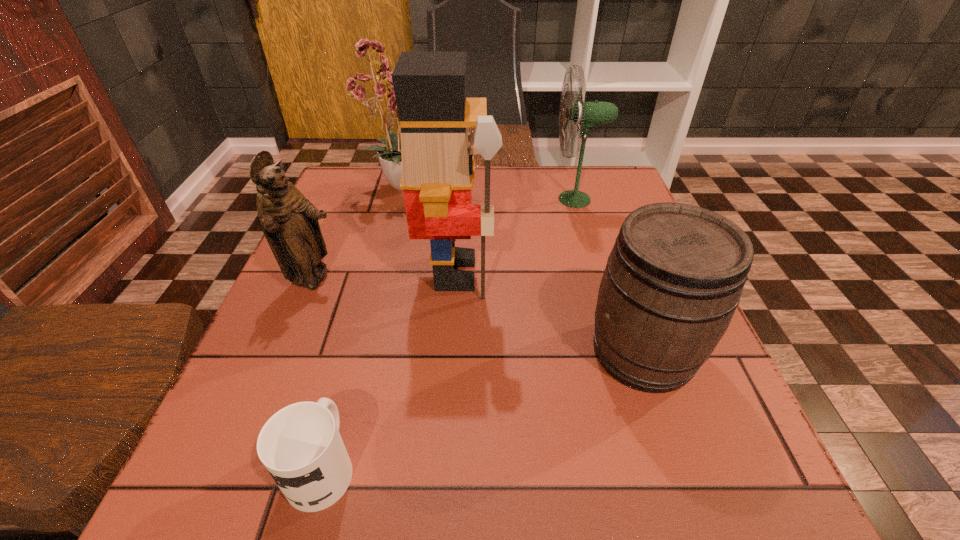
You are a GUI agent. You are given a task and a screenshot of the screen. Output one action in this format:
    pyautogui.click(x=<x>, y=<y>)
    Task: Click on the flower arrangement that is at the left edge
    
    Given the screenshot: What is the action you would take?
    pyautogui.click(x=376, y=102)

I want to click on figurine situated at the left edge, so click(x=289, y=221).

This screenshot has width=960, height=540. In order to click on mug positioned at the left edge in this screenshot , I will do `click(301, 447)`.

The image size is (960, 540). Find the location of `fan present at the right edge`. fan present at the right edge is located at coordinates (586, 115).

Where is `wine bucket situated at the right edge`? wine bucket situated at the right edge is located at coordinates (674, 278).

Identify the location of object positioned at the far left corner. The height and width of the screenshot is (540, 960). (376, 102).

This screenshot has width=960, height=540. Find the location of `object that is positioned at the near left corner`. object that is positioned at the near left corner is located at coordinates (301, 447).

I want to click on object that is at the far right corner, so click(586, 115).

The height and width of the screenshot is (540, 960). What are the coordinates of `free space at the far edge` in the screenshot? It's located at tap(552, 168).

Image resolution: width=960 pixels, height=540 pixels. Find the location of `free space at the near edge`. free space at the near edge is located at coordinates (472, 508).